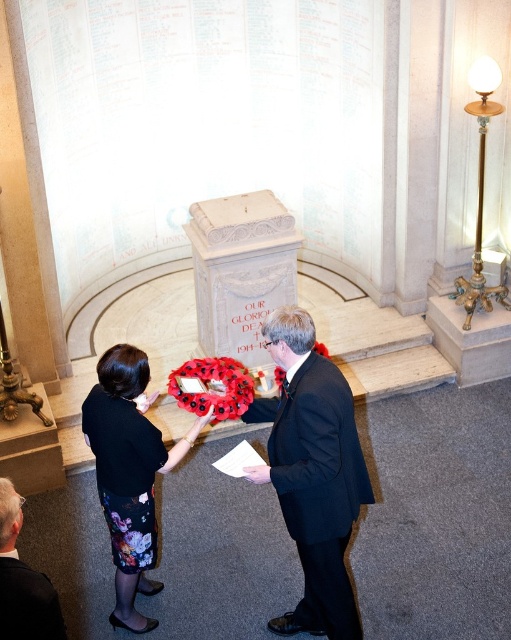
Is black suit at center bigger than floral skirt at center?

Yes.

Who is positioned more to the right, black suit at center or floral skirt at center?

black suit at center

Which is in front, point (316, 403) or point (150, 456)?

Point (316, 403) is more forward.

You are a GUI agent. You are given a task and a screenshot of the screen. Output one action in this format:
    pyautogui.click(x=<x>, y=<y>)
    Task: Click on the black suit at center
    This screenshot has height=640, width=511.
    Given the screenshot: What is the action you would take?
    pyautogui.click(x=313, y=474)

Does floral skirt at center have a greater height compared to dark suit at lower left?

Correct, floral skirt at center is much taller as dark suit at lower left.

Locate an element on the screen. floral skirt at center is located at coordinates (129, 474).

Locate an element on the screen. The width and height of the screenshot is (511, 640). floral skirt at center is located at coordinates click(129, 474).

Which is above, black suit at center or dark suit at lower left?

black suit at center

Who is shorter, black suit at center or dark suit at lower left?

Standing shorter between the two is dark suit at lower left.

Is point (265, 420) behind point (0, 561)?

Yes, it is behind point (0, 561).

Identify the location of black suit at center. (313, 474).